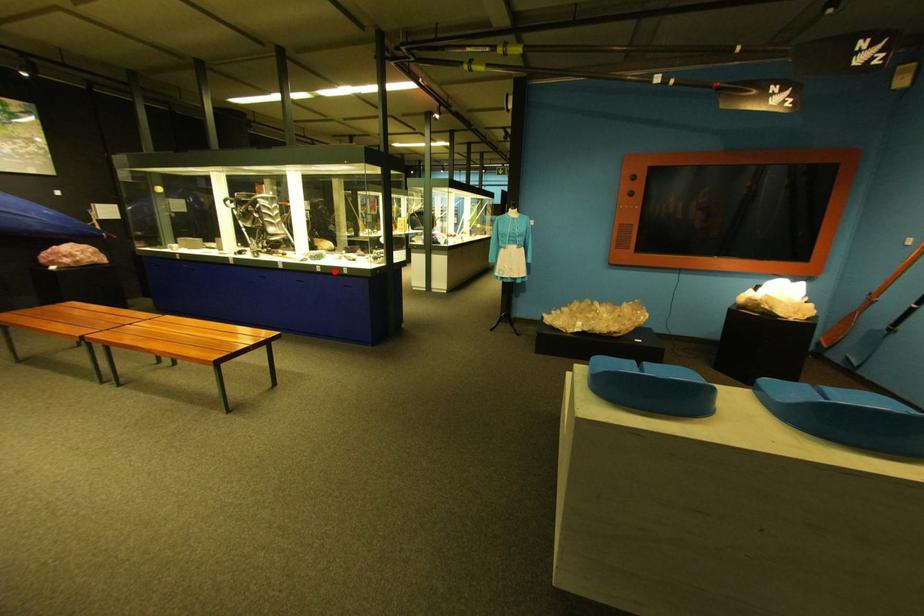
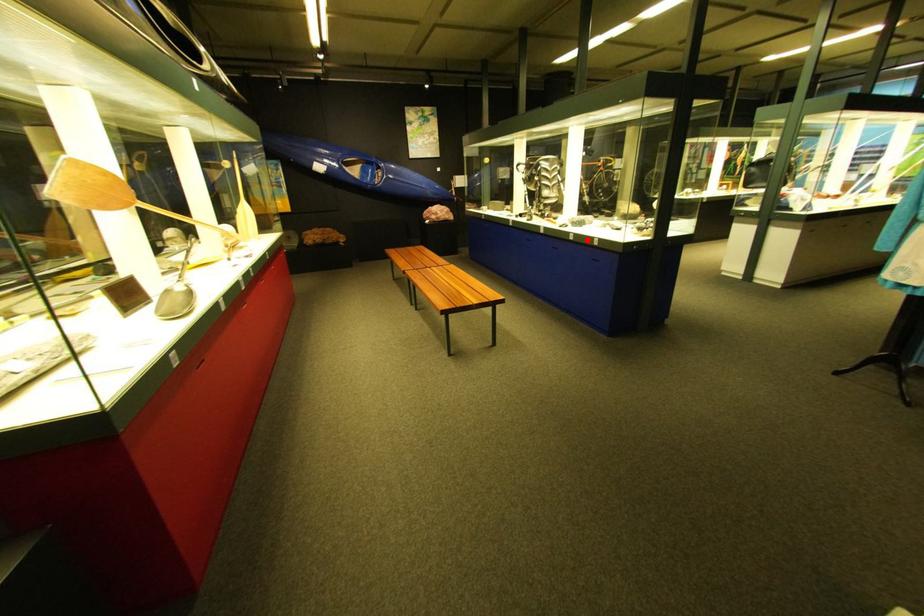
I am providing you with two images of the same scene from different viewpoints. A red point is marked on the first image and another point is marked on the second image. Does the point marked in image1 correspond to the same location as the one in image2?

Yes